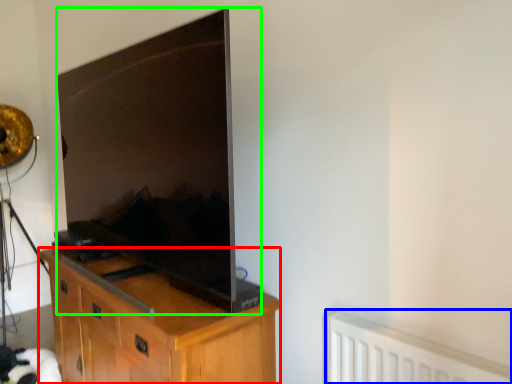
Question: Considering the real-world distances, which object is closest to cabinetry (highlighted by a red box)? radiator (highlighted by a blue box) or television (highlighted by a green box).

Choices:
 (A) radiator
 (B) television

Answer: (B)